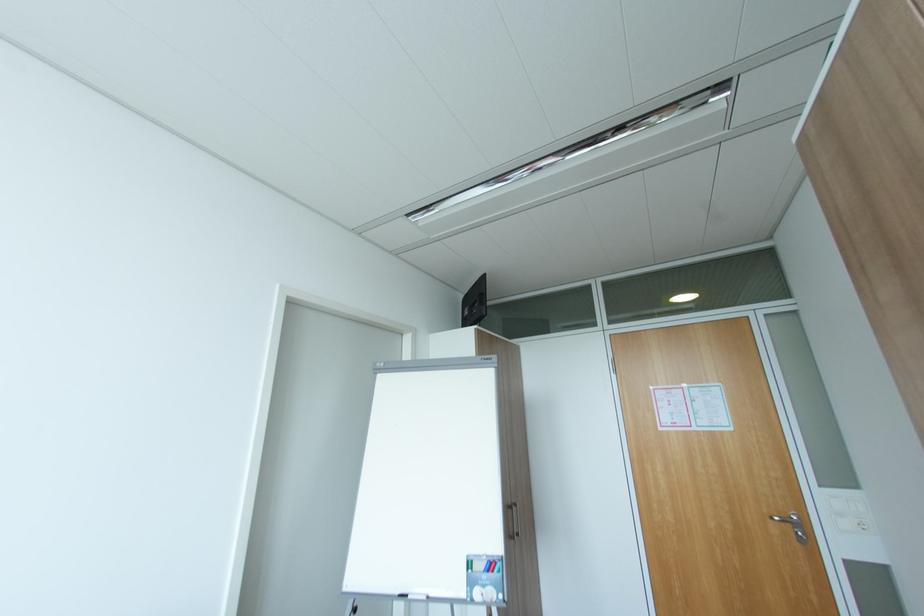
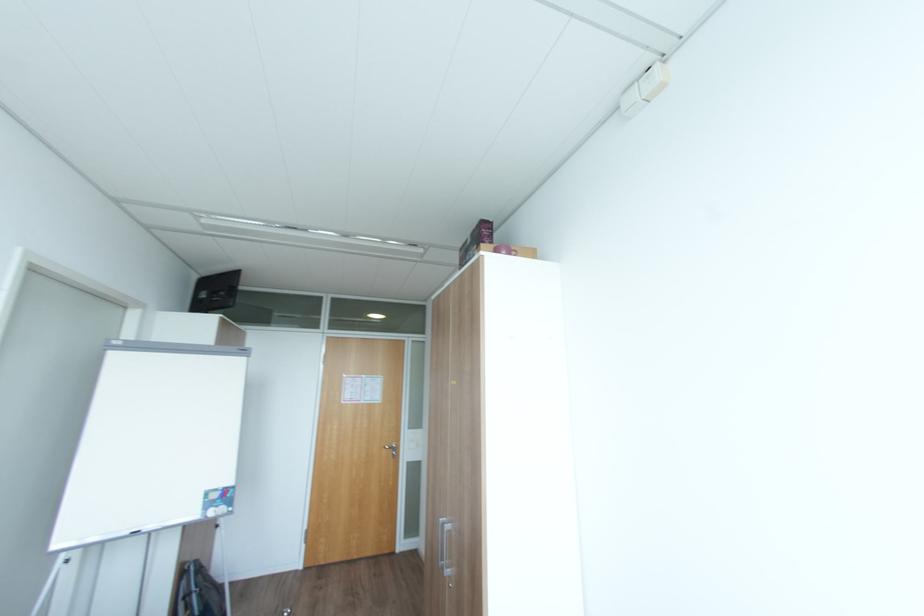
The point at (783, 517) is marked in the first image. Where is the corresponding point in the second image?

(392, 448)